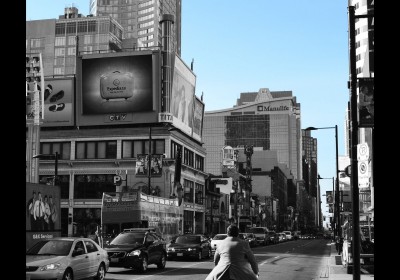
Where is `tv`? This screenshot has width=400, height=280. tv is located at coordinates (131, 105).